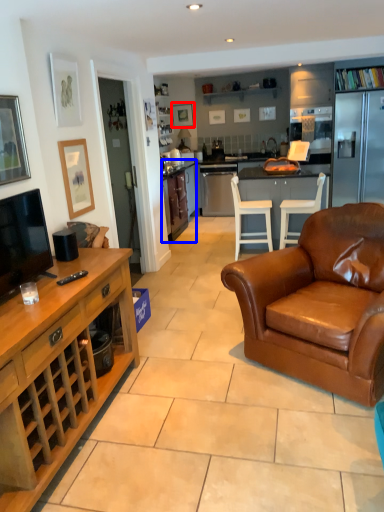
Question: Which of the following is the closest to the observer, picture frame (highlighted by a red box) or cabinetry (highlighted by a blue box)?

Choices:
 (A) picture frame
 (B) cabinetry

Answer: (B)